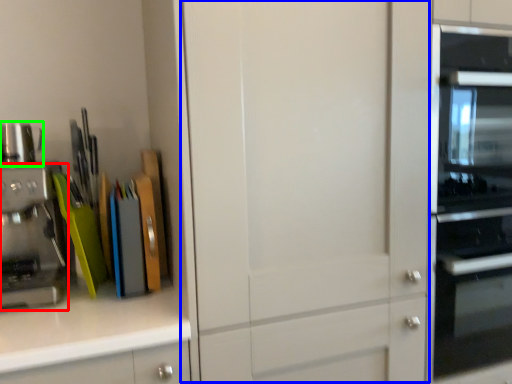
Question: Based on their relative distances, which object is farther from kitchen appliance (highlighted by a red box)? Choose from glass door (highlighted by a blue box) and appliance (highlighted by a green box).

Choices:
 (A) glass door
 (B) appliance

Answer: (A)